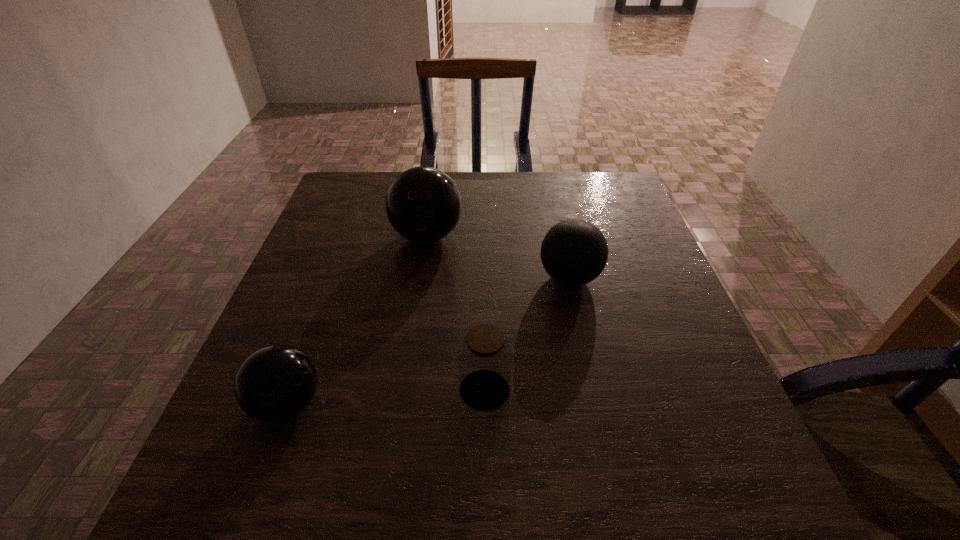
This screenshot has height=540, width=960. I want to click on the tallest object, so click(423, 204).

Locate an element on the screen. the second bowling ball from left to right is located at coordinates (423, 204).

I want to click on the rightmost bowling ball, so click(574, 252).

Where is `the second object from right to left`? The width and height of the screenshot is (960, 540). the second object from right to left is located at coordinates (484, 358).

Where is `the shortest bowling ball`? The width and height of the screenshot is (960, 540). the shortest bowling ball is located at coordinates (275, 383).

Where is `the leftmost object`? the leftmost object is located at coordinates (275, 383).

The width and height of the screenshot is (960, 540). What are the coordinates of `free region located 0.170m on the surface of the tallest bowling ball near the finger holes` in the screenshot? It's located at (417, 308).

The height and width of the screenshot is (540, 960). In order to click on free space located on the grip area of the rightmost object in this screenshot , I will do `click(469, 278)`.

Identify the location of vacant space situated on the grip area of the rightmost object. Image resolution: width=960 pixels, height=540 pixels. (444, 278).

Locate an element on the screen. This screenshot has height=540, width=960. free region located on the grip area of the rightmost object is located at coordinates (516, 278).